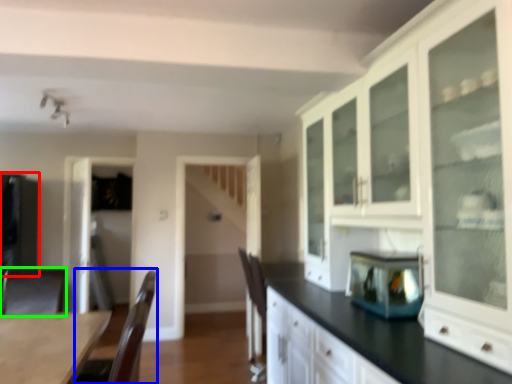
Question: Which object is the closest to the appliance (highlighted by a red box)? Choose among these: armchair (highlighted by a blue box) or armchair (highlighted by a green box).

Choices:
 (A) armchair
 (B) armchair

Answer: (B)